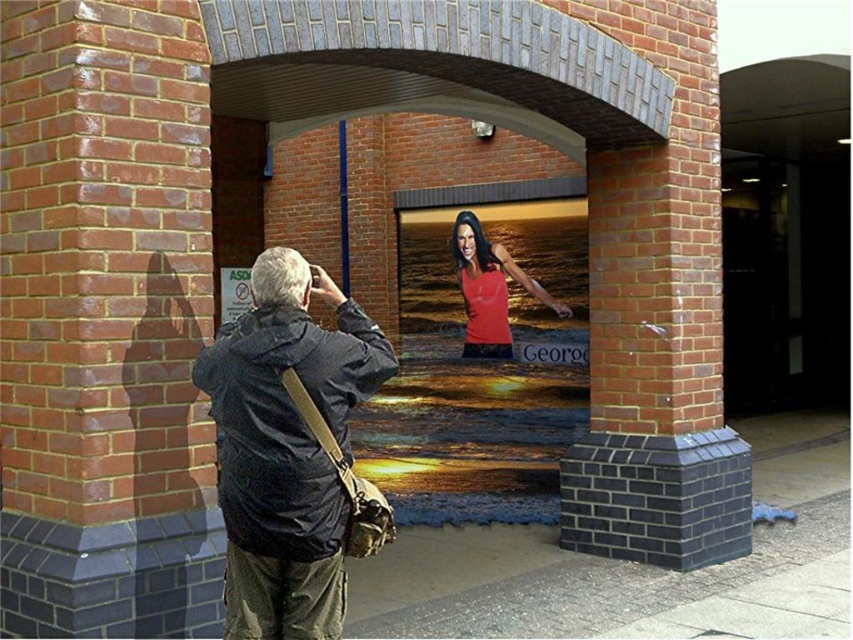
Question: Can you confirm if dark blue jacket at center is bigger than matte red tank top at center?

Choices:
 (A) no
 (B) yes

Answer: (A)

Question: Which object is closer to the camera taking this photo?

Choices:
 (A) matte red tank top at center
 (B) dark blue jacket at center

Answer: (B)

Question: Is dark blue jacket at center above matte red tank top at center?

Choices:
 (A) no
 (B) yes

Answer: (A)

Question: Which point is closer to the camera?

Choices:
 (A) dark blue jacket at center
 (B) matte red tank top at center

Answer: (A)

Question: Does dark blue jacket at center appear on the left side of matte red tank top at center?

Choices:
 (A) yes
 (B) no

Answer: (A)